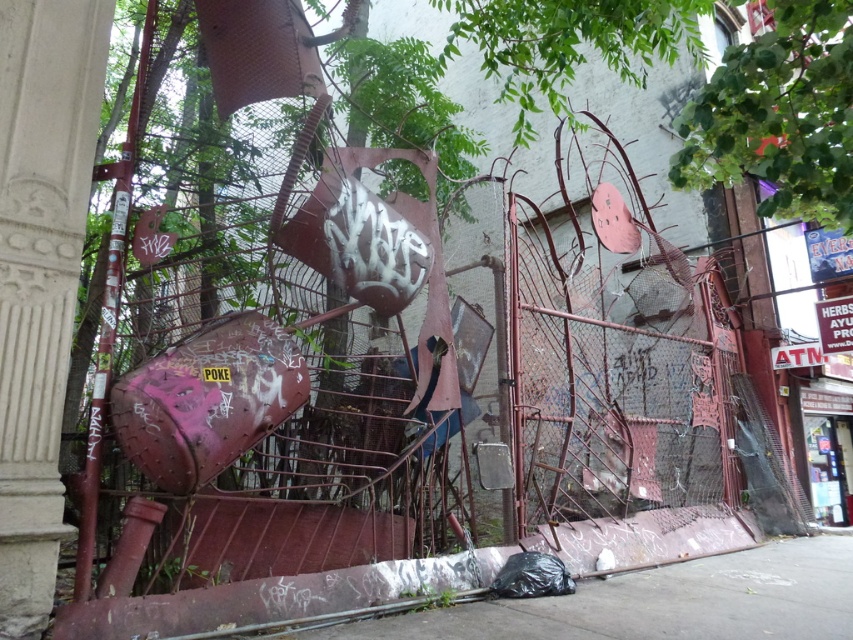
Which of these two, white carved stone pillar at left or concrete pavement at lower center, stands shorter?

concrete pavement at lower center is shorter.

Who is positioned more to the left, white carved stone pillar at left or concrete pavement at lower center?

white carved stone pillar at left

Consider the image. Measure the distance between point [22,396] and camera.

Point [22,396] is 2.57 meters away from camera.

At what (x,y) coordinates should I click in order to perform the action: click on white carved stone pillar at left. Please return your answer as a coordinate pair (x, y). This screenshot has width=853, height=640. Looking at the image, I should click on (39, 273).

Is point (45, 35) more distant than point (726, 60)?

That is True.

Does white carved stone pillar at left appear under green leafy tree at upper right?

Correct, white carved stone pillar at left is located below green leafy tree at upper right.

Is point (21, 141) positioned behind point (688, 180)?

No, (21, 141) is in front of (688, 180).

Find the location of a particular element. This screenshot has width=853, height=640. white carved stone pillar at left is located at coordinates (39, 273).

Is concrete pavement at lower center taller than green leafy tree at upper right?

In fact, concrete pavement at lower center may be shorter than green leafy tree at upper right.

Does concrete pavement at lower center appear on the right side of green leafy tree at upper right?

Incorrect, concrete pavement at lower center is not on the right side of green leafy tree at upper right.

Measure the distance between concrete pavement at lower center and camera.

The distance of concrete pavement at lower center from camera is 9.56 feet.

Identify the location of concrete pavement at lower center. (660, 602).